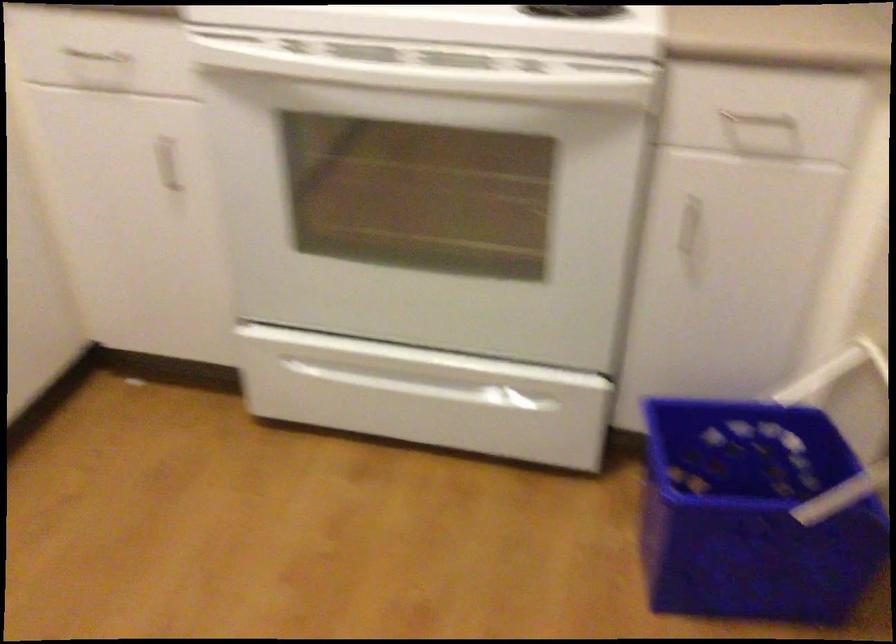
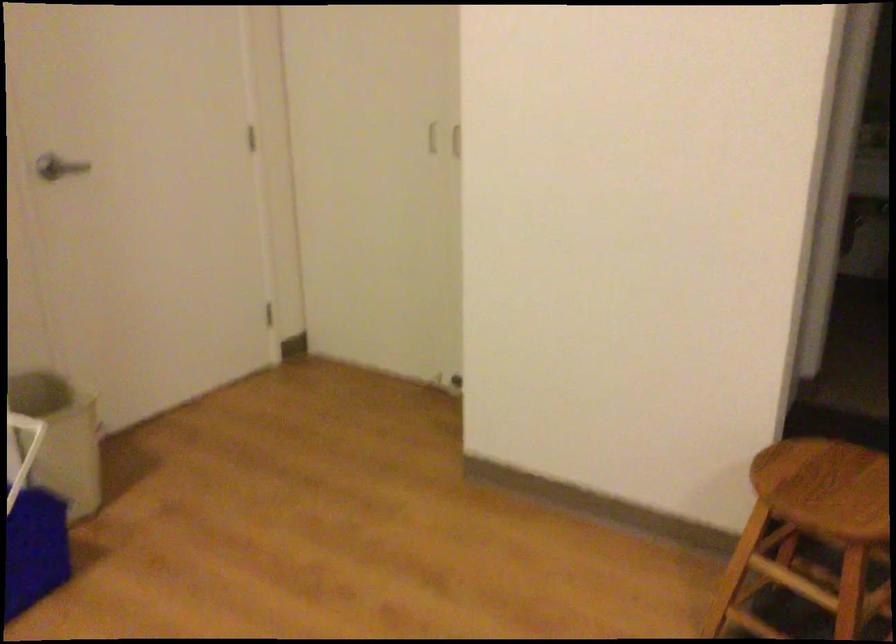
Question: Based on the continuous images, in which direction is the camera rotating? Reply with the corresponding letter.

Choices:
 (A) Left
 (B) Right
 (C) Up
 (D) Down

Answer: (B)